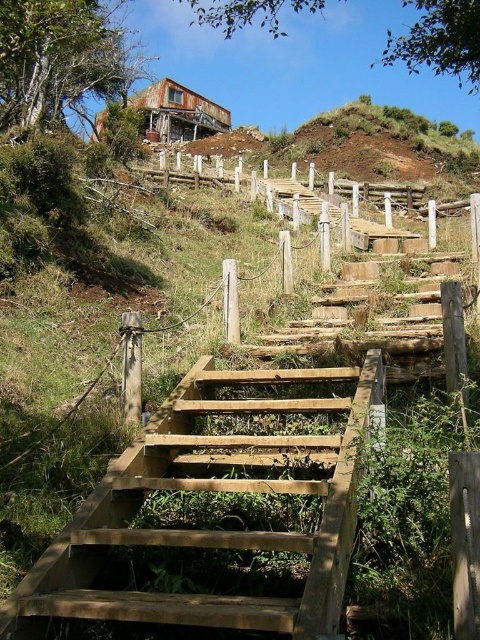
You are a hiker carrying a large backpack and need to climb the natural wood stairs at center. Considering the wooden fence at upper center is nearby, which structure has a narrower width that might make climbing the stairs more challenging?

The natural wood stairs at center has a lesser width compared to the wooden fence at upper center, so the stairs are narrower, making climbing them more challenging due to their narrower steps.

You are a hiker standing at the bottom of the natural wood stairs at center. You want to reach the wooden fence at upper center. According to the scene, which direction should you go?

The natural wood stairs at center is below the wooden fence at upper center, so you should go upwards to reach the wooden fence at upper center.